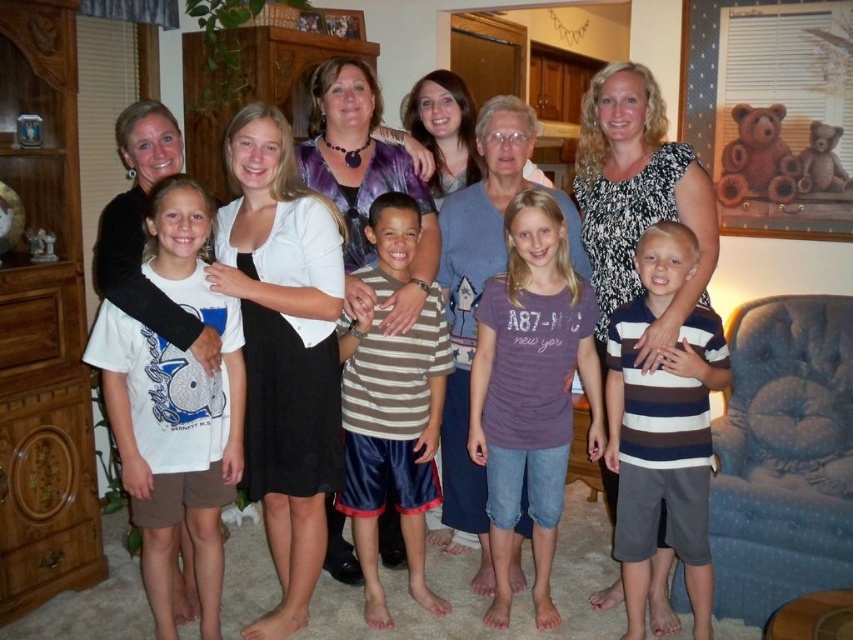
Question: Estimate the real-world distances between objects in this image. Which object is closer to the white matte cardigan at center?

Choices:
 (A) white cotton shirt at center
 (B) striped fabric shorts at center
 (C) striped cotton shirt at center
 (D) purple cotton shirt at center

Answer: (B)

Question: Among these points, which one is nearest to the camera?

Choices:
 (A) (550, 260)
 (B) (367, 576)
 (C) (335, 513)

Answer: (A)

Question: Which object is positioned farthest from the striped fabric shorts at center?

Choices:
 (A) striped cotton shirt at center
 (B) white cotton t-shirt at center
 (C) purple tie-dye shirt at center
 (D) white matte cardigan at center

Answer: (A)

Question: In this image, where is striped cotton shirt at center located relative to striped fabric shorts at center?

Choices:
 (A) right
 (B) left

Answer: (A)

Question: Can you confirm if white matte cardigan at center is thinner than white cotton shirt at center?

Choices:
 (A) yes
 (B) no

Answer: (A)

Question: Does purple cotton shirt at center have a larger size compared to striped cotton shirt at center?

Choices:
 (A) yes
 (B) no

Answer: (A)